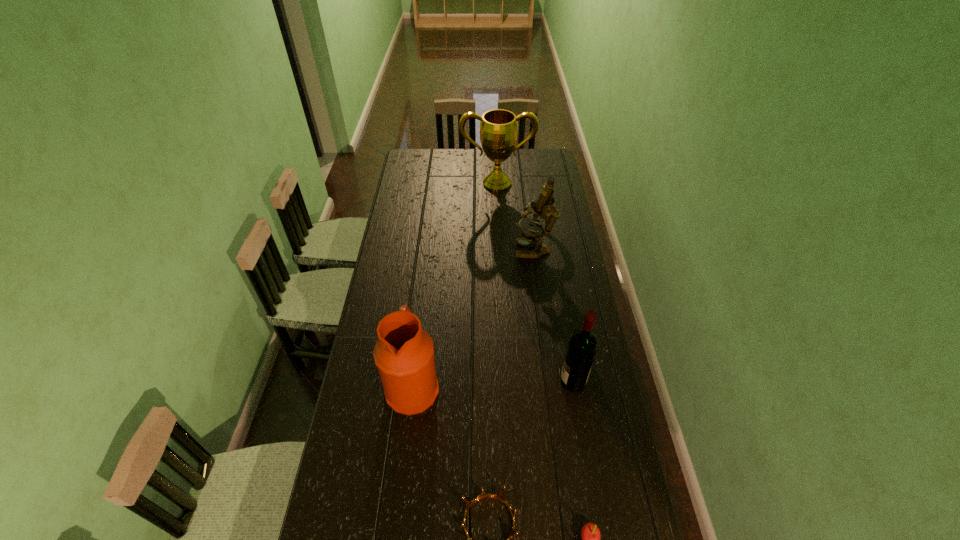
The width and height of the screenshot is (960, 540). What are the coordinates of `the farthest object` in the screenshot? It's located at (498, 128).

Where is `microscope`? Image resolution: width=960 pixels, height=540 pixels. microscope is located at coordinates (544, 208).

The image size is (960, 540). I want to click on alcohol, so click(x=583, y=344).

Where is `water jug`? The height and width of the screenshot is (540, 960). water jug is located at coordinates (404, 353).

The image size is (960, 540). Identify the location of vacant area situated on the front-facing side of the farthest object. (499, 232).

The width and height of the screenshot is (960, 540). In order to click on free space located on the back of the fifth nearest object in this screenshot , I will do `click(527, 195)`.

Find the location of `free space located on the front and back of the alcohol`. free space located on the front and back of the alcohol is located at coordinates (458, 381).

Where is `vacant space positioned 0.090m on the front and back of the alcohol`? The image size is (960, 540). vacant space positioned 0.090m on the front and back of the alcohol is located at coordinates (535, 381).

Where is `vacant space located on the front and back of the alcohol`? This screenshot has width=960, height=540. vacant space located on the front and back of the alcohol is located at coordinates (474, 381).

The width and height of the screenshot is (960, 540). Find the location of `free space located from the spout of the water jug`. free space located from the spout of the water jug is located at coordinates (529, 387).